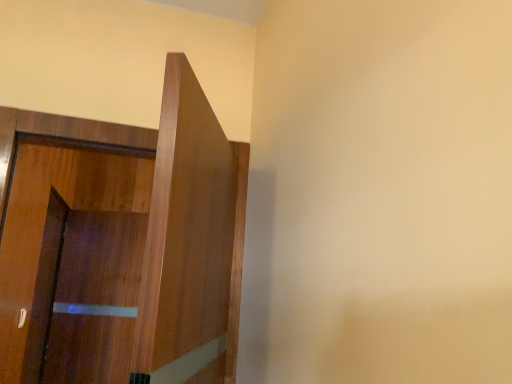
This screenshot has height=384, width=512. In order to click on brown wood screen door at left in this screenshot , I will do `click(95, 298)`.

Measure the distance between brown wood screen door at left and camera.

The distance of brown wood screen door at left from camera is 8.72 feet.

Describe the element at coordinates (95, 298) in the screenshot. This screenshot has width=512, height=384. I see `brown wood screen door at left` at that location.

What do you see at coordinates (121, 245) in the screenshot? This screenshot has width=512, height=384. I see `wooden door at left` at bounding box center [121, 245].

Measure the distance between point (245, 193) and camera.

A distance of 1.67 meters exists between point (245, 193) and camera.

What is the approximate height of wooden door at left?

It is 36.76 inches.

Locate an element on the screen. The height and width of the screenshot is (384, 512). wooden door at left is located at coordinates coord(121,245).

What are the coordinates of `brown wood screen door at left` in the screenshot? It's located at (95, 298).

Considering the positions of objects wooden door at left and brown wood screen door at left in the image provided, who is more to the right, wooden door at left or brown wood screen door at left?

wooden door at left.

Which object is closer to the camera, wooden door at left or brown wood screen door at left?

wooden door at left is closer to the camera.

Is point (51, 207) positioned before point (62, 374)?

No, it is behind (62, 374).

From the image's perspective, is wooden door at left on top of brown wood screen door at left?

Yes.

From a real-world perspective, is wooden door at left over brown wood screen door at left?

Yes.

Can you confirm if wooden door at left is wider than brown wood screen door at left?

Yes.

Who is shorter, wooden door at left or brown wood screen door at left?

Standing shorter between the two is wooden door at left.

Between wooden door at left and brown wood screen door at left, which one has smaller size?

brown wood screen door at left is smaller.

Based on the photo, would you say wooden door at left is inside or outside brown wood screen door at left?

wooden door at left is located beyond the bounds of brown wood screen door at left.

Looking at this image, would you say wooden door at left is a long distance from brown wood screen door at left?

No, there isn't a large distance between wooden door at left and brown wood screen door at left.

Is wooden door at left positioned with its back to brown wood screen door at left?

That's right, wooden door at left is facing away from brown wood screen door at left.

Can you tell me how much wooden door at left and brown wood screen door at left differ in facing direction?

The angle between the facing direction of wooden door at left and the facing direction of brown wood screen door at left is 19.8 degrees.

Locate an element on the screen. The width and height of the screenshot is (512, 384). door that is in front of the brown wood screen door at left is located at coordinates [121, 245].

Considering the relative positions of brown wood screen door at left and wooden door at left in the image provided, is brown wood screen door at left to the right of wooden door at left from the viewer's perspective?

Incorrect, brown wood screen door at left is not on the right side of wooden door at left.

Is brown wood screen door at left closer to the viewer compared to wooden door at left?

No, brown wood screen door at left is behind wooden door at left.

Does point (123, 285) lie in front of point (222, 358)?

No, (123, 285) is further to viewer.

From the image's perspective, is brown wood screen door at left below wooden door at left?

Correct, brown wood screen door at left appears lower than wooden door at left in the image.

In the scene shown: From a real-world perspective, is brown wood screen door at left located beneath wooden door at left?

Yes, from a real-world perspective, brown wood screen door at left is under wooden door at left.

Is brown wood screen door at left wider than wooden door at left?

In fact, brown wood screen door at left might be narrower than wooden door at left.

Considering the relative sizes of brown wood screen door at left and wooden door at left in the image provided, is brown wood screen door at left shorter than wooden door at left?

No, brown wood screen door at left is not shorter than wooden door at left.

Between brown wood screen door at left and wooden door at left, which one has smaller size?

brown wood screen door at left is smaller.

Which is correct: brown wood screen door at left is inside wooden door at left, or outside of it?

brown wood screen door at left is outside wooden door at left.

Are brown wood screen door at left and wooden door at left beside each other?

Yes, brown wood screen door at left is next to wooden door at left.

Is brown wood screen door at left positioned with its back to wooden door at left?

No, wooden door at left is not at the back of brown wood screen door at left.

How much distance is there between brown wood screen door at left and wooden door at left?

The distance of brown wood screen door at left from wooden door at left is 1.76 inches.

You are a GUI agent. You are given a task and a screenshot of the screen. Output one action in this format:
    pyautogui.click(x=<x>, y=<y>)
    Task: Click on the screen door below the wooden door at left (from the image's perspective)
    
    Given the screenshot: What is the action you would take?
    pyautogui.click(x=95, y=298)

In order to click on screen door below the wooden door at left (from a real-world perspective) in this screenshot , I will do `click(95, 298)`.

Where is `door that appears above the brown wood screen door at left (from a real-world perspective)`? This screenshot has width=512, height=384. door that appears above the brown wood screen door at left (from a real-world perspective) is located at coordinates (121, 245).